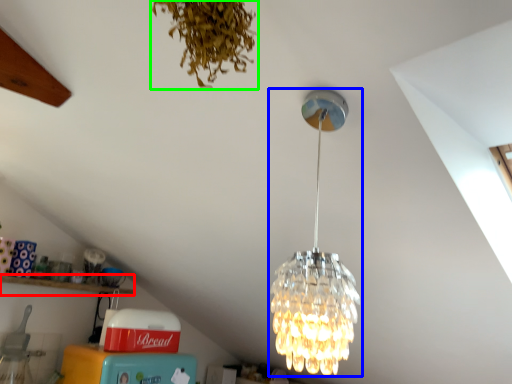
Question: Based on their relative distances, which object is nearer to shelf (highlighted by a red box)? Choose from lamp (highlighted by a blue box) and plant (highlighted by a green box).

Choices:
 (A) lamp
 (B) plant

Answer: (A)